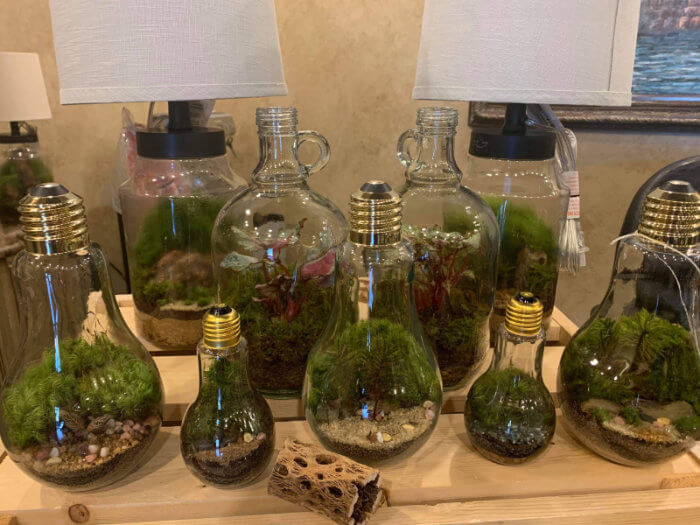
Find the location of a particular element. picture is located at coordinates (673, 51).